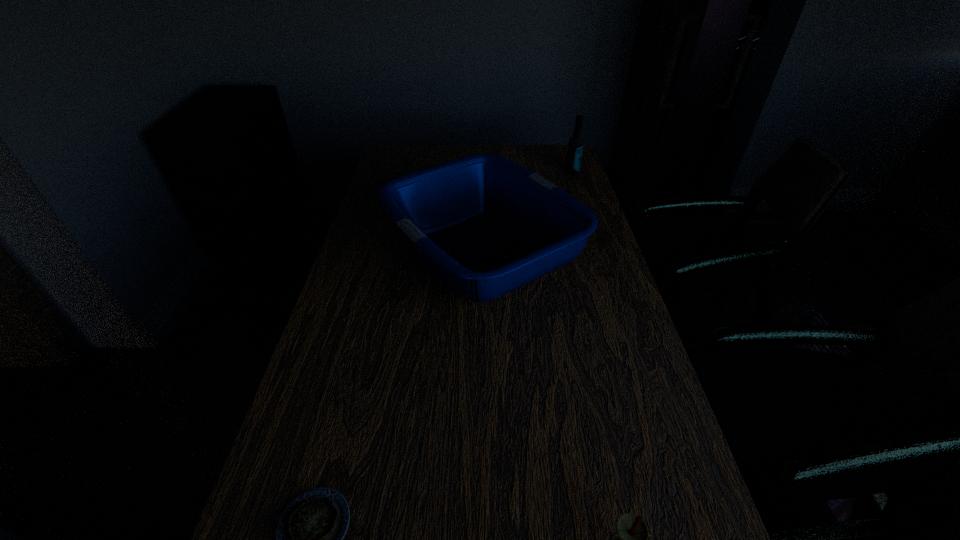
The width and height of the screenshot is (960, 540). Find the location of `the farthest object`. the farthest object is located at coordinates (575, 147).

Identify the location of the tallest object. (575, 147).

Locate an element on the screen. The width and height of the screenshot is (960, 540). the second farthest object is located at coordinates (487, 225).

At what (x,y) coordinates should I click in order to perform the action: click on the third shortest object. Please return your answer as a coordinate pair (x, y). Image resolution: width=960 pixels, height=540 pixels. Looking at the image, I should click on (487, 225).

Find the location of a particular element. This screenshot has height=540, width=960. free location located 0.270m on the label of the beer bottle is located at coordinates (586, 215).

Identify the location of vacant space situated 0.180m on the front of the second tallest object. (484, 396).

Locate an element on the screen. This screenshot has width=960, height=540. object positioned at the far edge is located at coordinates 575,147.

I want to click on object situated at the left edge, so click(487, 225).

You are a GUI agent. You are given a task and a screenshot of the screen. Output one action in this format:
    pyautogui.click(x=<x>, y=<y>)
    Task: Click on the beer bottle that is at the right edge
    
    Given the screenshot: What is the action you would take?
    pyautogui.click(x=575, y=147)

The height and width of the screenshot is (540, 960). What are the coordinates of `tray present at the right edge` in the screenshot? It's located at (487, 225).